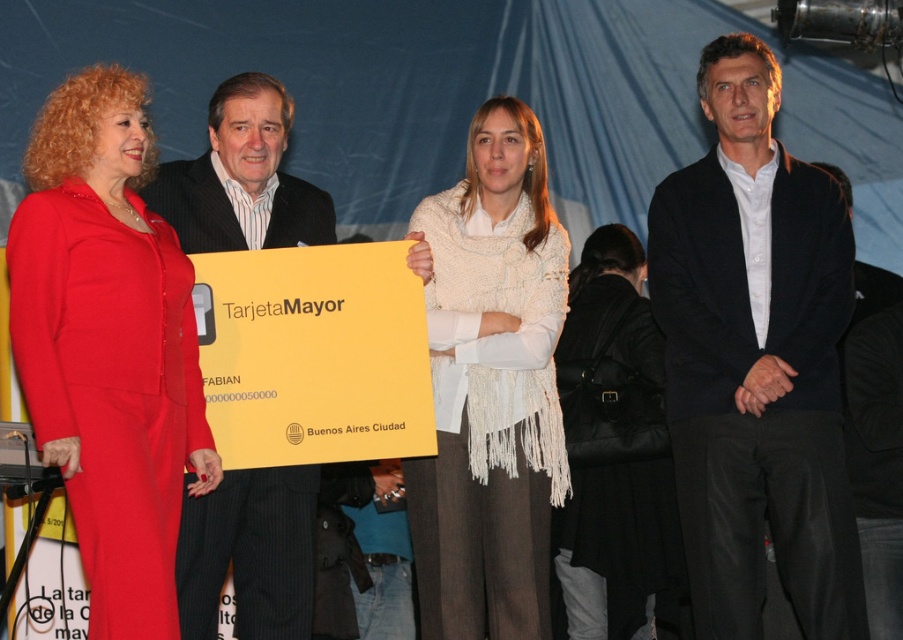
Can you confirm if matte red dress at left is positioned below dark suit at center?

Indeed, matte red dress at left is positioned under dark suit at center.

Who is lower down, matte red dress at left or dark suit at center?

matte red dress at left is lower down.

The height and width of the screenshot is (640, 903). Identify the location of matte red dress at left. (109, 346).

Can you confirm if dark blue textured blazer at right is positioned to the right of white knitted scarf at center?

Indeed, dark blue textured blazer at right is positioned on the right side of white knitted scarf at center.

Who is positioned more to the left, dark blue textured blazer at right or white knitted scarf at center?

Positioned to the left is white knitted scarf at center.

The width and height of the screenshot is (903, 640). I want to click on dark blue textured blazer at right, so click(x=756, y=360).

Identify the location of dark blue textured blazer at right. click(x=756, y=360).

Which of these two, dark suit at center or black leather handbag at center, stands taller?

black leather handbag at center is taller.

You are a GUI agent. You are given a task and a screenshot of the screen. Output one action in this format:
    pyautogui.click(x=<x>, y=<y>)
    Task: Click on the dark suit at center
    This screenshot has width=903, height=640.
    Given the screenshot: What is the action you would take?
    pyautogui.click(x=250, y=554)

Is point (259, 208) farther from viewer compared to point (639, 474)?

No, it is not.

The width and height of the screenshot is (903, 640). I want to click on dark suit at center, so click(x=250, y=554).